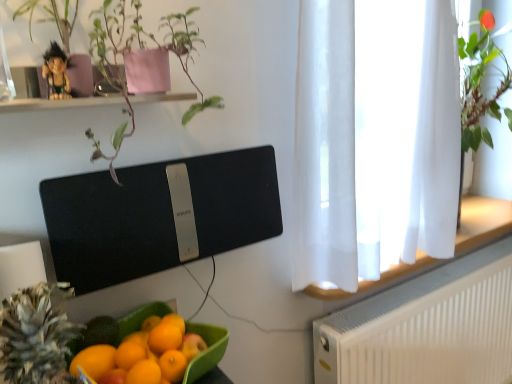
Question: Is white sheer curtain at right bigger than white textured radiator at lower right?

Choices:
 (A) yes
 (B) no

Answer: (A)

Question: From the image's perspective, is white sheer curtain at right located beneath white textured radiator at lower right?

Choices:
 (A) yes
 (B) no

Answer: (B)

Question: Does white sheer curtain at right lie behind white textured radiator at lower right?

Choices:
 (A) no
 (B) yes

Answer: (A)

Question: Is white sheer curtain at right aimed at white textured radiator at lower right?

Choices:
 (A) yes
 (B) no

Answer: (B)

Question: Can you see white sheer curtain at right touching white textured radiator at lower right?

Choices:
 (A) no
 (B) yes

Answer: (A)

Question: Considering the relative positions of white sheer curtain at right and white textured radiator at lower right in the image provided, is white sheer curtain at right to the left of white textured radiator at lower right from the viewer's perspective?

Choices:
 (A) no
 (B) yes

Answer: (B)

Question: Is black matte speaker at upper center further to the viewer compared to green matte plant at upper left?

Choices:
 (A) yes
 (B) no

Answer: (A)

Question: From a real-world perspective, is black matte speaker at upper center below green matte plant at upper left?

Choices:
 (A) no
 (B) yes

Answer: (B)

Question: Is black matte speaker at upper center not close to green matte plant at upper left?

Choices:
 (A) yes
 (B) no

Answer: (B)

Question: From the image's perspective, is black matte speaker at upper center below green matte plant at upper left?

Choices:
 (A) no
 (B) yes

Answer: (B)

Question: Is black matte speaker at upper center bigger than green matte plant at upper left?

Choices:
 (A) no
 (B) yes

Answer: (A)

Question: Is black matte speaker at upper center looking in the opposite direction of green matte plant at upper left?

Choices:
 (A) no
 (B) yes

Answer: (A)

Question: From the image's perspective, is black matte speaker at upper center on white sheer curtain at right?

Choices:
 (A) no
 (B) yes

Answer: (A)